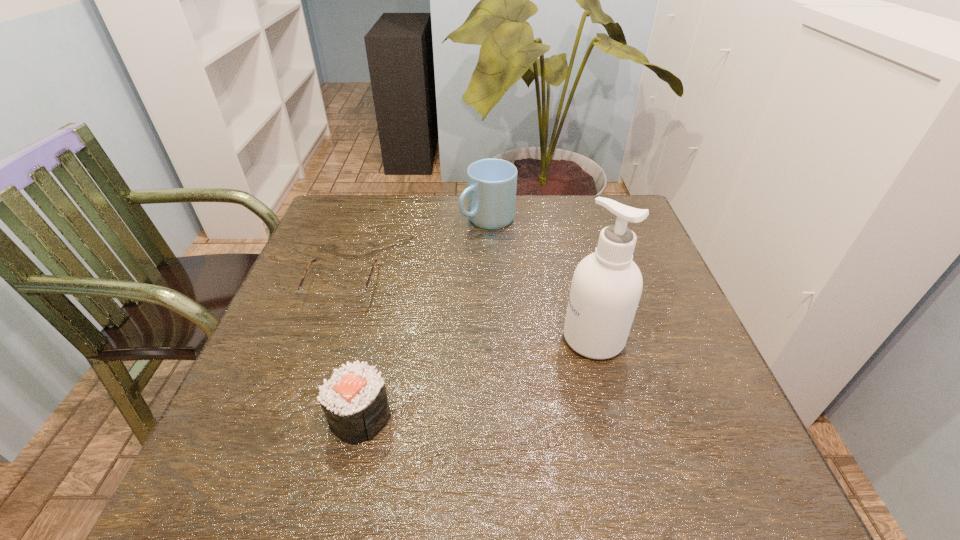
The width and height of the screenshot is (960, 540). I want to click on free space located on the front label of the third farthest object, so click(x=516, y=338).

This screenshot has width=960, height=540. Find the location of `blank space located 0.080m on the front of the third object from left to right`. blank space located 0.080m on the front of the third object from left to right is located at coordinates (489, 252).

You are a GUI agent. You are given a task and a screenshot of the screen. Output one action in this format:
    pyautogui.click(x=<x>, y=<y>)
    Task: Click on the vacant space located 0.290m on the right of the third tallest object
    Image resolution: width=960 pixels, height=540 pixels.
    Given the screenshot: What is the action you would take?
    pyautogui.click(x=552, y=416)

Locate an element on the screen. vacant space located 0.130m on the front-facing side of the spectacles is located at coordinates (318, 356).

In order to click on object that is at the far edge in this screenshot , I will do `click(491, 188)`.

The height and width of the screenshot is (540, 960). I want to click on object present at the left edge, so click(347, 299).

Where is `object that is at the right edge`? object that is at the right edge is located at coordinates (606, 287).

You are a GUI agent. You are given a task and a screenshot of the screen. Output one action in this format:
    pyautogui.click(x=<x>, y=<y>)
    Task: Click on the blank area at the far edge
    
    Given the screenshot: What is the action you would take?
    pyautogui.click(x=509, y=234)

Where is `free spot at the near edge of the desktop`? free spot at the near edge of the desktop is located at coordinates pos(307,457).

The width and height of the screenshot is (960, 540). In the image, there is a desktop. Identify the location of vacant space at the left edge. (284, 399).